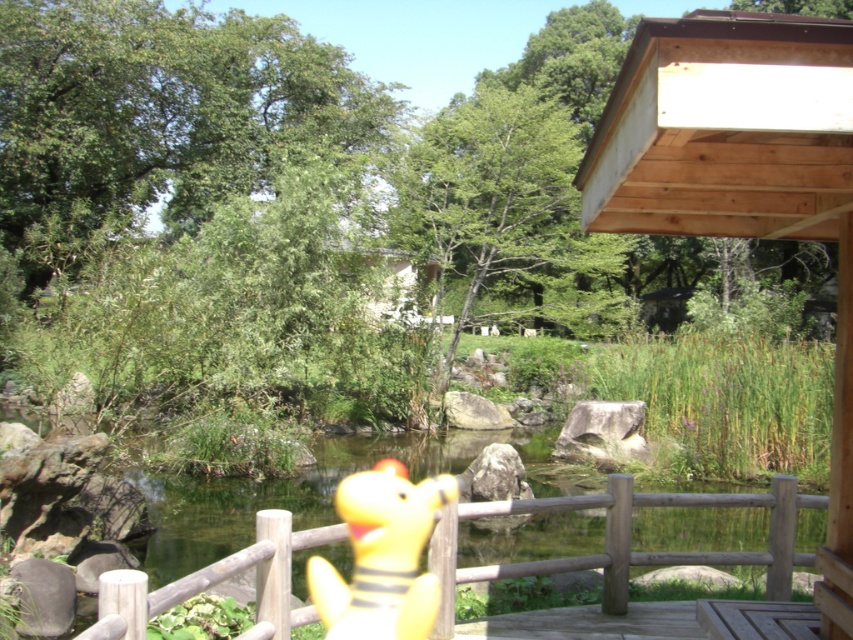
Question: Among these objects, which one is nearest to the camera?

Choices:
 (A) wooden at center
 (B) yellow rubber duck at center

Answer: (B)

Question: Is wooden at center above yellow rubber duck at center?

Choices:
 (A) no
 (B) yes

Answer: (B)

Question: Is wooden at center thinner than yellow rubber duck at center?

Choices:
 (A) no
 (B) yes

Answer: (A)

Question: From the image, what is the correct spatial relationship of wooden at center in relation to yellow rubber duck at center?

Choices:
 (A) below
 (B) above

Answer: (B)